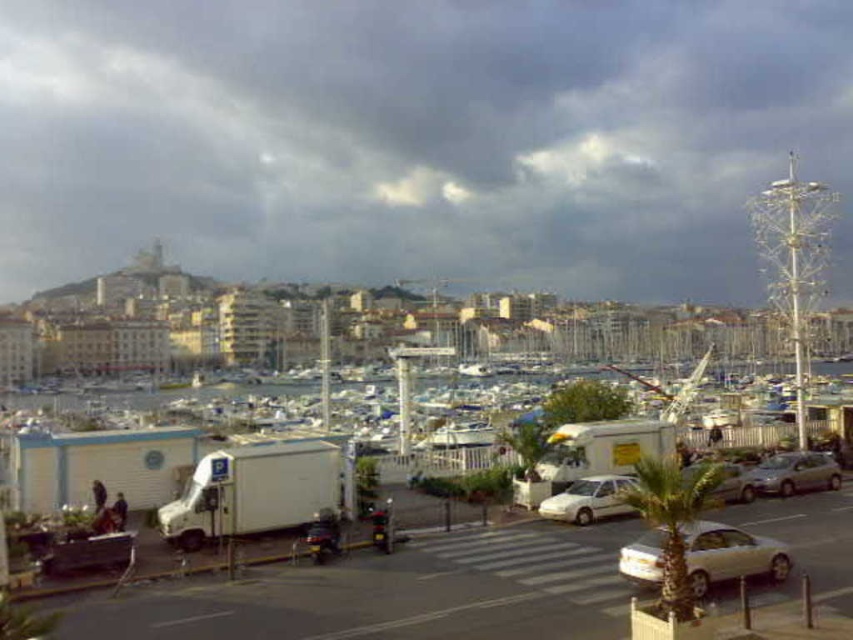
Question: Among these objects, which one is nearest to the camera?

Choices:
 (A) silver metallic car at center
 (B) green leafy palm tree at center-right

Answer: (B)

Question: Which is farther from the white glossy car at lower right?

Choices:
 (A) silver metallic car at center
 (B) white matte car at center
 (C) silver metallic hatchback at lower right
 (D) white matte trailer truck at lower left

Answer: (C)

Question: Which is farther from the white matte truck at lower center?

Choices:
 (A) white glossy car at lower right
 (B) green leafy palm tree at center-right
 (C) silver metallic car at center
 (D) white matte car at center

Answer: (C)

Question: Can you confirm if silver metallic hatchback at lower right is positioned below silver metallic car at center?

Choices:
 (A) yes
 (B) no

Answer: (A)

Question: Is white matte truck at lower center wider than green leafy palm tree at center-right?

Choices:
 (A) no
 (B) yes

Answer: (B)

Question: Can you confirm if green leafy palm tree at center-right is wider than silver metallic hatchback at lower right?

Choices:
 (A) no
 (B) yes

Answer: (B)